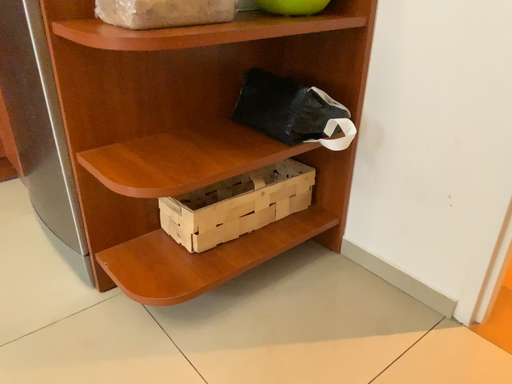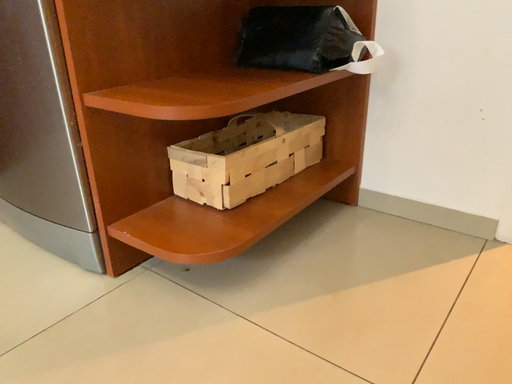
Question: How did the camera likely rotate when shooting the video?

Choices:
 (A) rotated left
 (B) rotated right

Answer: (B)